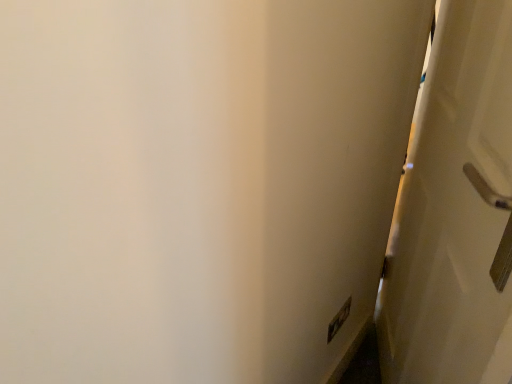
What do you see at coordinates (455, 212) in the screenshot?
I see `white glossy door at right` at bounding box center [455, 212].

This screenshot has height=384, width=512. What are the coordinates of `white glossy door at right` in the screenshot? It's located at (455, 212).

Where is `white glossy door at right`? This screenshot has height=384, width=512. white glossy door at right is located at coordinates (455, 212).